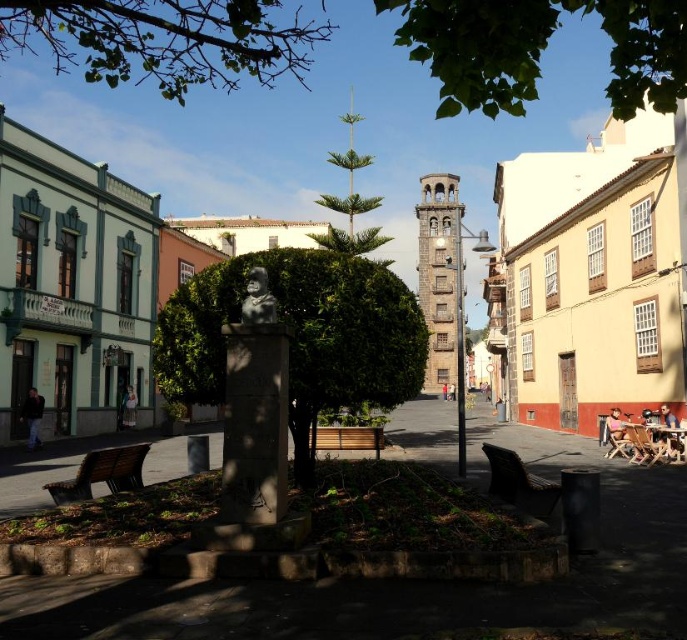
Does stone tower at center appear on the right side of dark blue jeans at lower left?

Yes, stone tower at center is to the right of dark blue jeans at lower left.

This screenshot has height=640, width=687. I want to click on stone tower at center, so click(x=438, y=275).

Find the location of a particular element. Image resolution: width=687 pixels, height=640 pixels. stone tower at center is located at coordinates tap(438, 275).

Can you confirm if green leafy tree at upper center is taller than dark blue jeans at lower left?

Yes, green leafy tree at upper center is taller than dark blue jeans at lower left.

Does green leafy tree at upper center appear on the left side of dark blue jeans at lower left?

Incorrect, green leafy tree at upper center is not on the left side of dark blue jeans at lower left.

Between point (664, 99) and point (23, 416), which one is positioned behind?

The point (23, 416) is behind.

Where is `green leafy tree at upper center`? green leafy tree at upper center is located at coordinates click(x=539, y=49).

Is the position of green leafy tree at upper center more distant than that of bronze statue at center?

No, green leafy tree at upper center is in front of bronze statue at center.

Who is more forward, (207,81) or (251,308)?

Positioned in front is point (251,308).

Identify the location of green leafy tree at upper center. The image size is (687, 640). (539, 49).